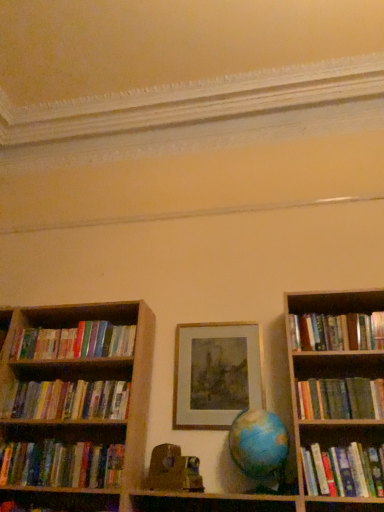
Question: From a real-world perspective, does hardcover books at left, the sixth book in the top-to-bottom sequence, stand above hardcover books at right, the first book in the top-to-bottom sequence?

Choices:
 (A) yes
 (B) no

Answer: (B)

Question: Can you confirm if hardcover books at left, which is the second book from bottom to top, is positioned to the right of hardcover books at right, which is counted as the seventh book, starting from the bottom?

Choices:
 (A) no
 (B) yes

Answer: (A)

Question: Is hardcover books at left, the sixth book in the top-to-bottom sequence, far away from hardcover books at right, which is counted as the seventh book, starting from the bottom?

Choices:
 (A) no
 (B) yes

Answer: (B)

Question: Is hardcover books at left, which is the second book from bottom to top, wider than hardcover books at right, which is counted as the seventh book, starting from the bottom?

Choices:
 (A) no
 (B) yes

Answer: (A)

Question: Can hardcover books at right, which is counted as the seventh book, starting from the bottom, be found inside hardcover books at left, which is the second book from bottom to top?

Choices:
 (A) no
 (B) yes

Answer: (A)

Question: From the image's perspective, is gold metallic picture frame at center located above or below green matte bookshelf at right, the 5th book in the bottom-to-top sequence?

Choices:
 (A) above
 (B) below

Answer: (A)

Question: Considering the positions of gold metallic picture frame at center and green matte bookshelf at right, the 5th book in the bottom-to-top sequence, in the image, is gold metallic picture frame at center bigger or smaller than green matte bookshelf at right, the 5th book in the bottom-to-top sequence,?

Choices:
 (A) big
 (B) small

Answer: (B)

Question: Is point (236, 326) closer or farther from the camera than point (340, 409)?

Choices:
 (A) closer
 (B) farther

Answer: (B)

Question: From a real-world perspective, is gold metallic picture frame at center physically located above or below green matte bookshelf at right, the 5th book in the bottom-to-top sequence?

Choices:
 (A) below
 (B) above

Answer: (B)

Question: Is point pos(163,467) closer or farther from the camera than point pos(64,507)?

Choices:
 (A) farther
 (B) closer

Answer: (B)

Question: From the image's perspective, is wooden toy at center located above or below hardcover book at lower left, which is counted as the seventh book, starting from the top?

Choices:
 (A) below
 (B) above

Answer: (B)

Question: Is wooden toy at center inside the boundaries of hardcover book at lower left, which is counted as the seventh book, starting from the top, or outside?

Choices:
 (A) inside
 (B) outside

Answer: (B)

Question: Considering the positions of wooden toy at center and hardcover book at lower left, the first book when ordered from bottom to top, in the image, is wooden toy at center wider or thinner than hardcover book at lower left, the first book when ordered from bottom to top,?

Choices:
 (A) wide
 (B) thin

Answer: (A)

Question: Is hardcover books at right, which ranks as the fifth book in top-to-bottom order, taller or shorter than hardcover book at lower left, which is counted as the seventh book, starting from the top?

Choices:
 (A) tall
 (B) short

Answer: (A)

Question: Is hardcover books at right, which ranks as the 3th book in bottom-to-top order, in front of or behind hardcover book at lower left, the first book when ordered from bottom to top, in the image?

Choices:
 (A) front
 (B) behind

Answer: (A)